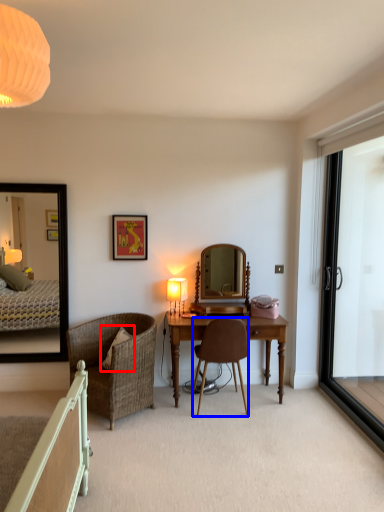
Question: Which of the following is the closest to the observer, pillow (highlighted by a red box) or chair (highlighted by a blue box)?

Choices:
 (A) pillow
 (B) chair

Answer: (B)